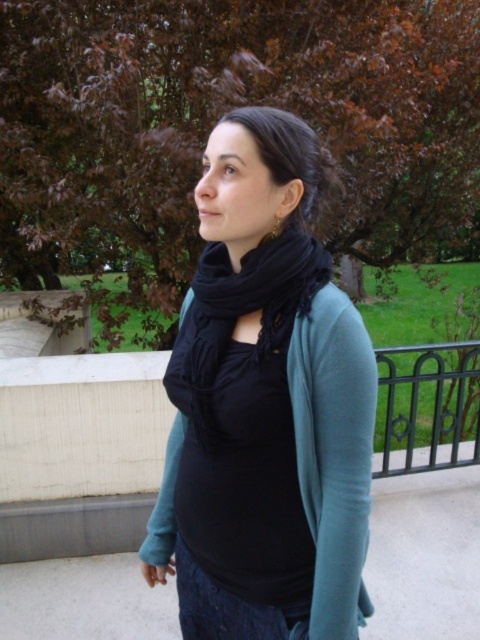
Between brown leafy tree at upper center and black soft scarf at center, which one is positioned lower?

black soft scarf at center is lower down.

Locate an element on the screen. Image resolution: width=480 pixels, height=640 pixels. brown leafy tree at upper center is located at coordinates (216, 118).

Is point (153, 116) positioned after point (173, 387)?

Yes, it is behind point (173, 387).

Identify the location of brown leafy tree at upper center. The image size is (480, 640). (216, 118).

Which is in front, point (324, 275) or point (195, 637)?

Point (324, 275) is more forward.

Is the position of black soft scarf at center more distant than that of denim at lower center?

No.

Which is behind, point (257, 292) or point (265, 636)?

The point (265, 636) is behind.

Find the location of a particular element. This screenshot has width=480, height=640. black soft scarf at center is located at coordinates (244, 308).

Is brown leafy tree at upper center taller than black matte scarf at center?

Yes, brown leafy tree at upper center is taller than black matte scarf at center.

Which is in front, point (396, 58) or point (237, 588)?

Positioned in front is point (237, 588).

Where is `brown leafy tree at upper center`? This screenshot has width=480, height=640. brown leafy tree at upper center is located at coordinates (216, 118).